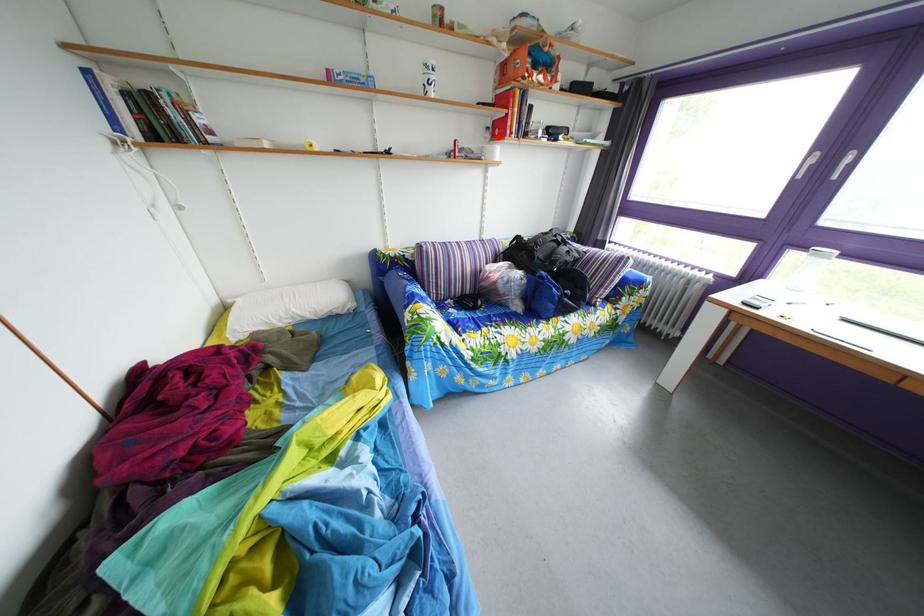
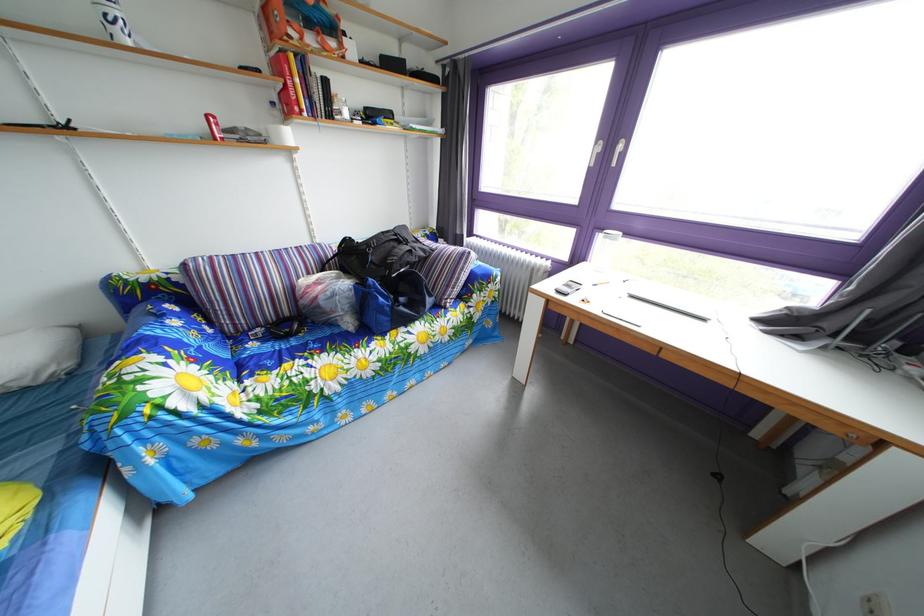
Question: I am providing you with two images of the same scene from different viewpoints. Given a red point in image1, look at the same physical point in image2. Is it:

Choices:
 (A) Closer to the viewpoint
 (B) Farther from the viewpoint

Answer: (B)